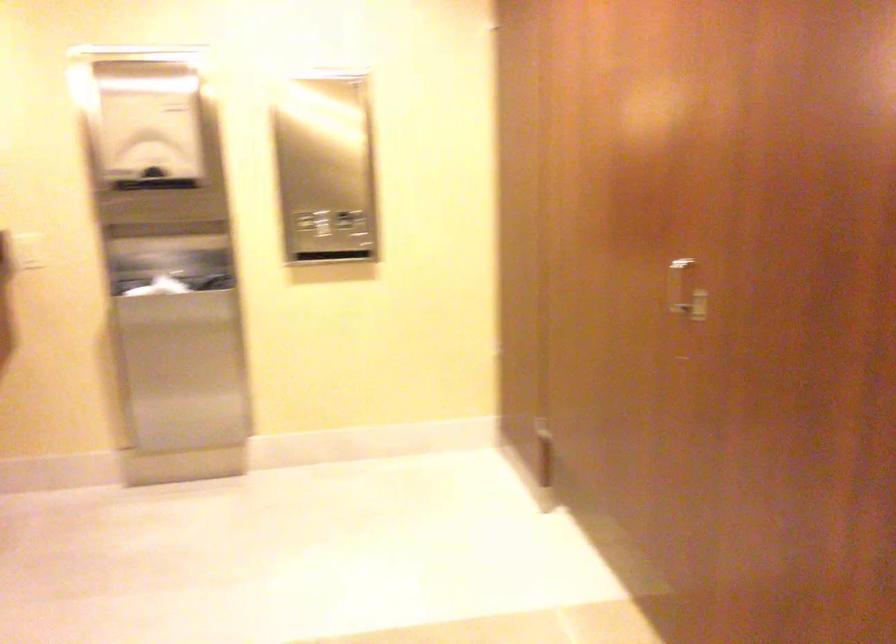
Describe the element at coordinates (317, 229) in the screenshot. I see `a dispenser dispensing lever` at that location.